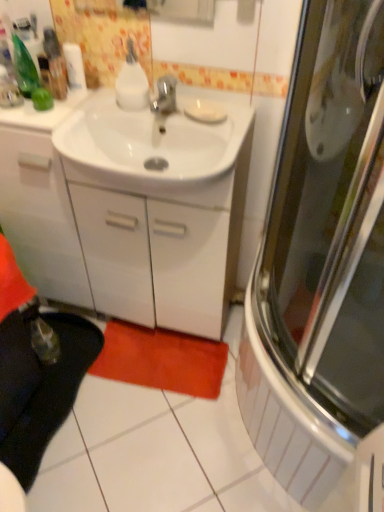
Question: From the image's perspective, is white glossy cabinet at center located beneath white matte toilet paper at upper left?

Choices:
 (A) no
 (B) yes

Answer: (B)

Question: Is white glossy cabinet at center facing away from white matte toilet paper at upper left?

Choices:
 (A) yes
 (B) no

Answer: (B)

Question: Is the depth of white glossy cabinet at center greater than that of white matte toilet paper at upper left?

Choices:
 (A) yes
 (B) no

Answer: (B)

Question: Does white glossy cabinet at center appear on the left side of white matte toilet paper at upper left?

Choices:
 (A) no
 (B) yes

Answer: (A)

Question: Could white matte toilet paper at upper left be considered to be inside white glossy cabinet at center?

Choices:
 (A) yes
 (B) no

Answer: (B)

Question: From the image's perspective, relative to white matte toilet paper at upper left, is white glossy cabinet at center above or below?

Choices:
 (A) above
 (B) below

Answer: (B)

Question: Is white glossy cabinet at center inside the boundaries of white matte toilet paper at upper left, or outside?

Choices:
 (A) outside
 (B) inside

Answer: (A)

Question: Is white glossy cabinet at center in front of or behind white matte toilet paper at upper left in the image?

Choices:
 (A) behind
 (B) front

Answer: (B)

Question: Looking at the image, does white glossy cabinet at center seem bigger or smaller compared to white matte toilet paper at upper left?

Choices:
 (A) small
 (B) big

Answer: (B)

Question: Is point (77, 65) closer or farther from the camera than point (89, 368)?

Choices:
 (A) farther
 (B) closer

Answer: (B)

Question: From their relative heights in the image, would you say white matte toilet paper at upper left is taller or shorter than orange plush bath mat at lower center?

Choices:
 (A) tall
 (B) short

Answer: (A)

Question: From a real-world perspective, relative to orange plush bath mat at lower center, is white matte toilet paper at upper left vertically above or below?

Choices:
 (A) below
 (B) above

Answer: (B)

Question: In terms of width, does white matte toilet paper at upper left look wider or thinner when compared to orange plush bath mat at lower center?

Choices:
 (A) wide
 (B) thin

Answer: (B)

Question: From a real-world perspective, relative to white glossy sink at center, is orange plush bath mat at lower center vertically above or below?

Choices:
 (A) below
 (B) above

Answer: (A)

Question: Is point (155, 377) closer or farther from the camera than point (233, 112)?

Choices:
 (A) closer
 (B) farther

Answer: (B)